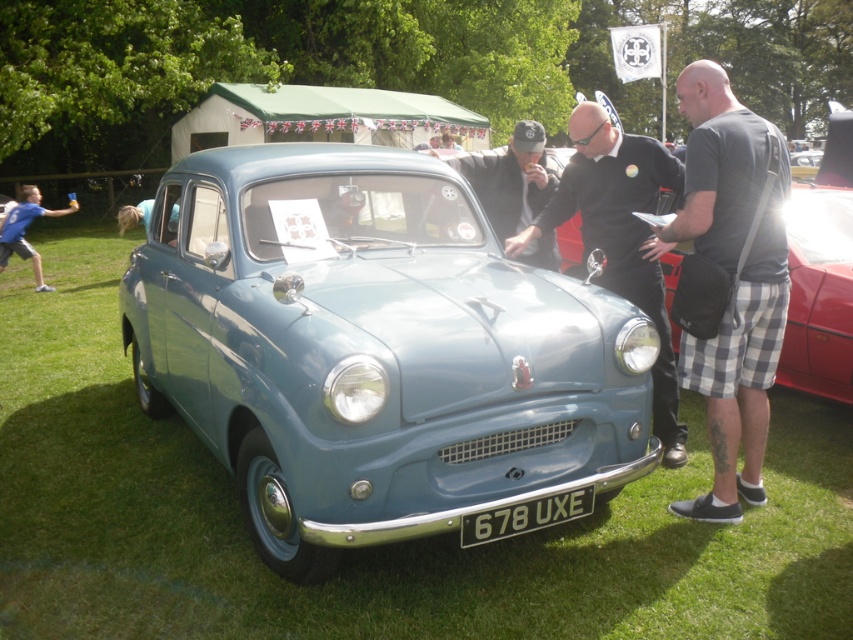
You are standing in front of the vintage teal car at the car show. You notice two points marked on the car. The first point is at coordinates point (370, 195) and the second point is at point (670, 186). Which of these two points is closer to you?

Point (370, 195) is closer to the viewer than point (670, 186).

You are an event organizer at the car show and need to place a new display stand between the black leather jacket at center and the metallic silver car at center. Considering their sizes, which object should the stand be closer to?

The black leather jacket at center is smaller than the metallic silver car at center, so the display stand should be placed closer to the metallic silver car at center to account for its larger size.

You are standing at the point marked by the coordinates (373,349) in the image. Looking around, you see a matte blue car at center. What object is located exactly at your current position?

The point marked by the coordinates (373,349) is exactly where the matte blue car at center is located.